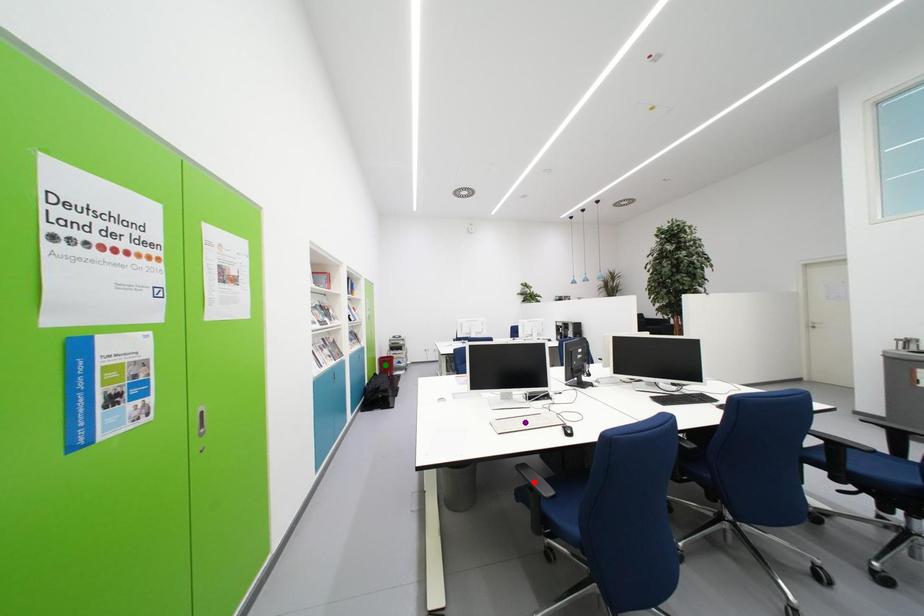
Order these from nearest to farthest:
- purple point
- green point
- red point

green point, purple point, red point